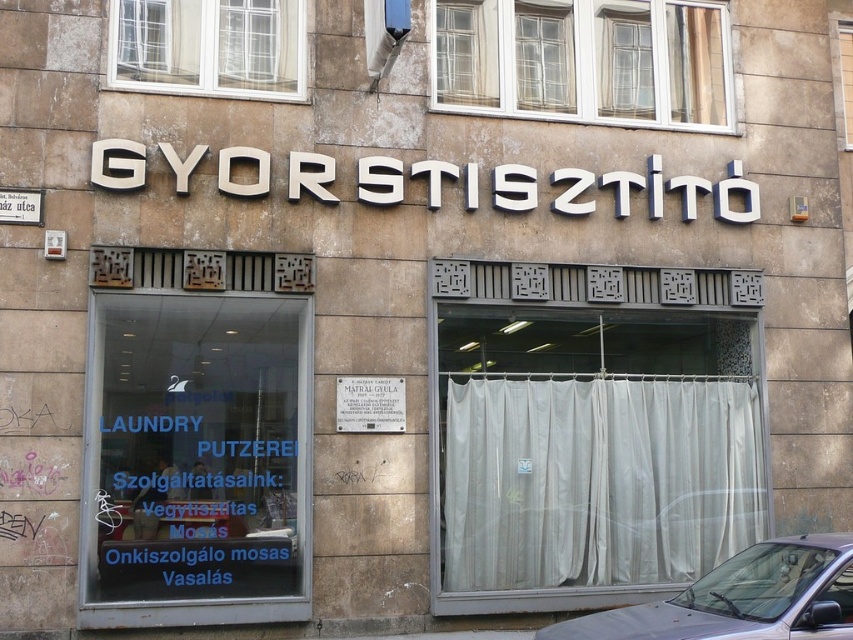
Question: Which point is closer to the camera taking this photo?

Choices:
 (A) (149, 51)
 (B) (634, 99)
 (C) (221, 595)
 (D) (465, 500)

Answer: (C)

Question: Which object appears closest to the camera in this image?

Choices:
 (A) transparent glass laundry sign at center
 (B) white glass window at upper left
 (C) gray metallic car at lower right

Answer: (C)

Question: Estimate the real-world distances between objects in this image. Which object is farther from the gray metallic car at lower right?

Choices:
 (A) white glass window at upper left
 (B) white fabric curtain at right
 (C) white plastic window at upper center
 (D) transparent glass laundry sign at center

Answer: (A)

Question: Can you confirm if transparent glass laundry sign at center is positioned to the right of white plastic window at upper center?

Choices:
 (A) no
 (B) yes

Answer: (A)

Question: Does white plastic window at upper center appear over gray metallic car at lower right?

Choices:
 (A) no
 (B) yes

Answer: (B)

Question: Is white fabric curtain at right below white glass window at upper left?

Choices:
 (A) no
 (B) yes

Answer: (B)